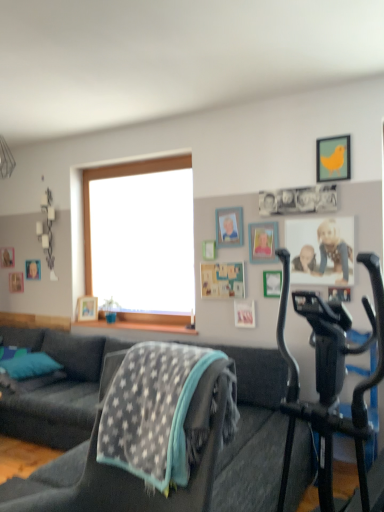
Question: Considering the relative sizes of wooden picture frame at upper right, the 4th picture frame viewed from the front, and wooden picture frame at upper center, marked as the third picture frame in a right-to-left arrangement, in the image provided, is wooden picture frame at upper right, the 4th picture frame viewed from the front, wider than wooden picture frame at upper center, marked as the third picture frame in a right-to-left arrangement,?

Choices:
 (A) yes
 (B) no

Answer: (B)

Question: Is wooden picture frame at upper right, which is counted as the fifth picture frame, starting from the back, to the left of wooden picture frame at upper center, the 6th picture frame from the left, from the viewer's perspective?

Choices:
 (A) yes
 (B) no

Answer: (A)

Question: Is wooden picture frame at upper right, the 4th picture frame viewed from the front, positioned beyond the bounds of wooden picture frame at upper center, which is the third picture frame in front-to-back order?

Choices:
 (A) yes
 (B) no

Answer: (A)

Question: Considering the relative sizes of wooden picture frame at upper right, the 4th picture frame positioned from the right, and wooden picture frame at upper center, which is the third picture frame in front-to-back order, in the image provided, is wooden picture frame at upper right, the 4th picture frame positioned from the right, shorter than wooden picture frame at upper center, which is the third picture frame in front-to-back order,?

Choices:
 (A) no
 (B) yes

Answer: (B)

Question: From a real-world perspective, is wooden picture frame at upper right, the 4th picture frame viewed from the front, below wooden picture frame at upper center, which is the third picture frame in front-to-back order?

Choices:
 (A) yes
 (B) no

Answer: (A)

Question: Is point (94, 309) positioned closer to the camera than point (238, 241)?

Choices:
 (A) closer
 (B) farther

Answer: (B)

Question: In terms of width, does wooden picture frame at lower left, which appears as the 3th picture frame when viewed from the back, look wider or thinner when compared to wooden photo frame at upper center, marked as the 5th picture frame in a right-to-left arrangement?

Choices:
 (A) thin
 (B) wide

Answer: (B)

Question: From their relative heights in the image, would you say wooden picture frame at lower left, marked as the 6th picture frame in a right-to-left arrangement, is taller or shorter than wooden photo frame at upper center, positioned as the 4th picture frame in left-to-right order?

Choices:
 (A) short
 (B) tall

Answer: (A)

Question: From a real-world perspective, is wooden picture frame at lower left, marked as the 6th picture frame in a right-to-left arrangement, physically located above or below wooden photo frame at upper center, positioned as the 4th picture frame in left-to-right order?

Choices:
 (A) below
 (B) above

Answer: (A)

Question: Looking at the image, does wooden picture frame at upper right, the 5th picture frame from the left, seem bigger or smaller compared to teal fabric pillow at lower left?

Choices:
 (A) big
 (B) small

Answer: (B)

Question: In terms of width, does wooden picture frame at upper right, the 4th picture frame positioned from the right, look wider or thinner when compared to teal fabric pillow at lower left?

Choices:
 (A) wide
 (B) thin

Answer: (B)

Question: From the image's perspective, is wooden picture frame at upper right, the 5th picture frame from the left, located above or below teal fabric pillow at lower left?

Choices:
 (A) below
 (B) above

Answer: (B)

Question: Considering the positions of wooden picture frame at upper right, the 5th picture frame from the left, and teal fabric pillow at lower left in the image, is wooden picture frame at upper right, the 5th picture frame from the left, taller or shorter than teal fabric pillow at lower left?

Choices:
 (A) short
 (B) tall

Answer: (B)

Question: Is wooden picture frame at left, which appears as the 1th picture frame when viewed from the left, inside the boundaries of wooden picture frame at lower left, which appears as the 3th picture frame when viewed from the back, or outside?

Choices:
 (A) inside
 (B) outside

Answer: (B)

Question: In the image, is wooden picture frame at left, positioned as the 8th picture frame in front-to-back order, positioned in front of or behind wooden picture frame at lower left, which ranks as the 3th picture frame in left-to-right order?

Choices:
 (A) front
 (B) behind

Answer: (B)